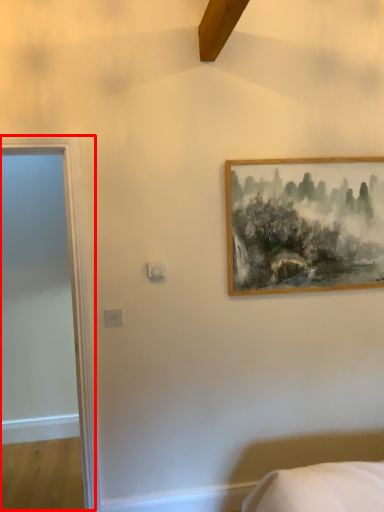
Question: From the image's perspective, considering the relative positions of door (annotated by the red box) and picture frame in the image provided, where is door (annotated by the red box) located with respect to the staircase?

Choices:
 (A) below
 (B) above

Answer: (A)